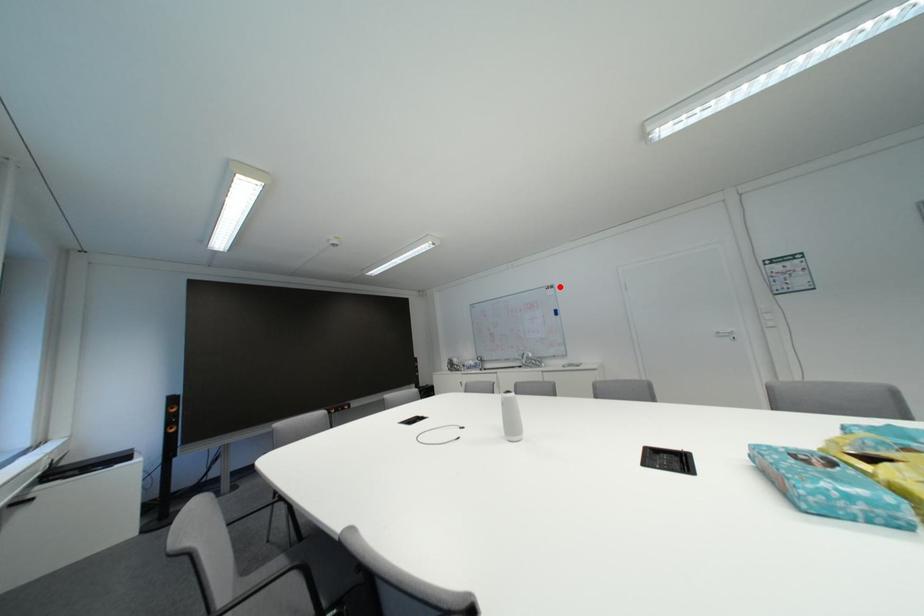
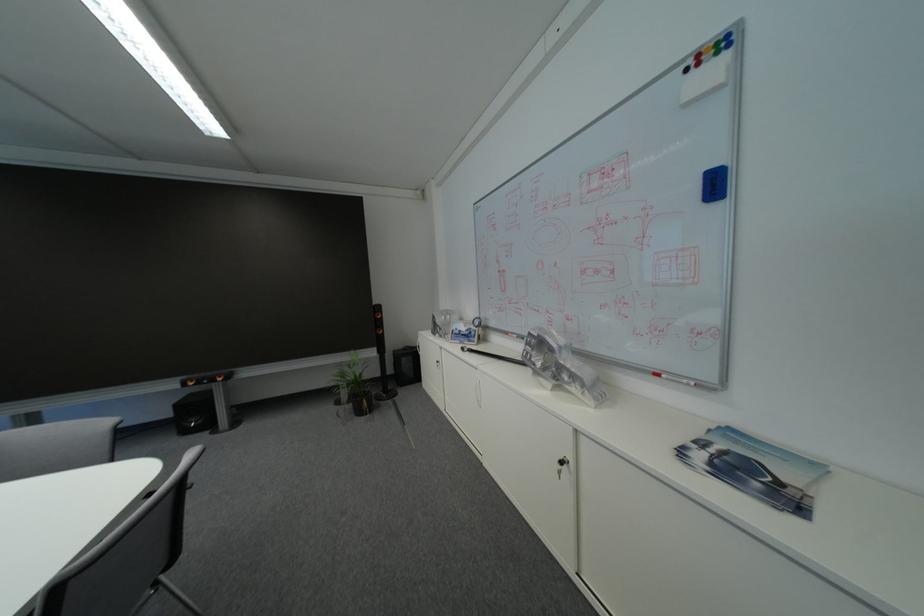
The point at the highlighted location is marked in the first image. Where is the corresponding point in the second image?

(723, 34)